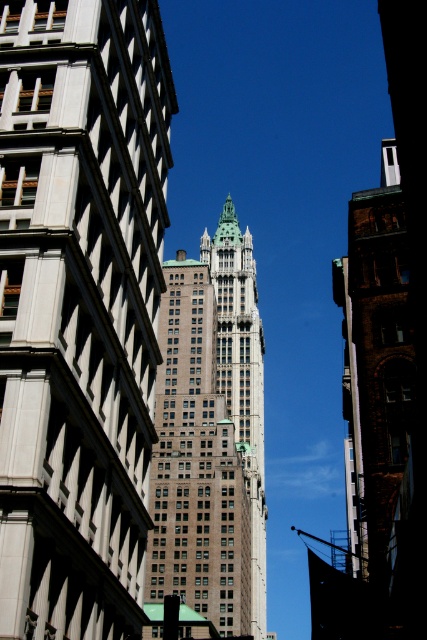
Question: Does white stone skyscraper at center come behind green stone tower at center?

Choices:
 (A) no
 (B) yes

Answer: (A)

Question: From the image, what is the correct spatial relationship of white stone skyscraper at center in relation to brown stone building at center?

Choices:
 (A) below
 (B) above

Answer: (B)

Question: Which point is closer to the camera?

Choices:
 (A) (35, 444)
 (B) (246, 234)

Answer: (A)

Question: Which point is closer to the camera?

Choices:
 (A) (233, 304)
 (B) (90, 212)

Answer: (B)

Question: Which point appears farthest from the camera in this image?

Choices:
 (A) (55, 195)
 (B) (257, 356)

Answer: (B)

Question: Does brown stone building at center have a lesser width compared to green stone tower at center?

Choices:
 (A) no
 (B) yes

Answer: (A)